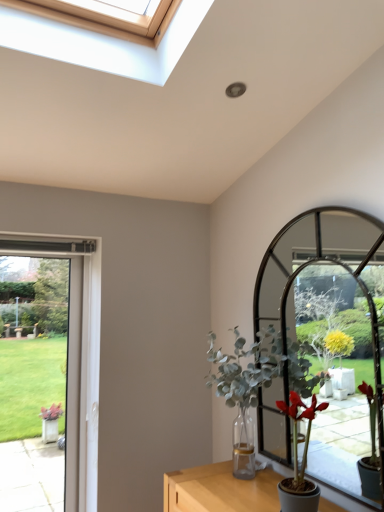
Question: From a real-world perspective, is matte green plant at right, the 2th houseplant when ordered from back to front, physically located above or below green leafy plant at center, the second houseplant when ordered from front to back?

Choices:
 (A) below
 (B) above

Answer: (A)

Question: Looking at the image, does matte green plant at right, placed as the first houseplant when sorted from front to back, seem bigger or smaller compared to green leafy plant at center, the second houseplant when ordered from front to back?

Choices:
 (A) big
 (B) small

Answer: (B)

Question: Which of these objects is positioned closest to the clear glass door at left?

Choices:
 (A) green leafy plant at center, the second houseplant when ordered from front to back
 (B) matte green plant at right, the 2th houseplant when ordered from back to front

Answer: (A)

Question: Estimate the real-world distances between objects in this image. Which object is farther from the green leafy plant at center, the second houseplant when ordered from front to back?

Choices:
 (A) matte green plant at right, placed as the first houseplant when sorted from front to back
 (B) clear glass door at left

Answer: (B)